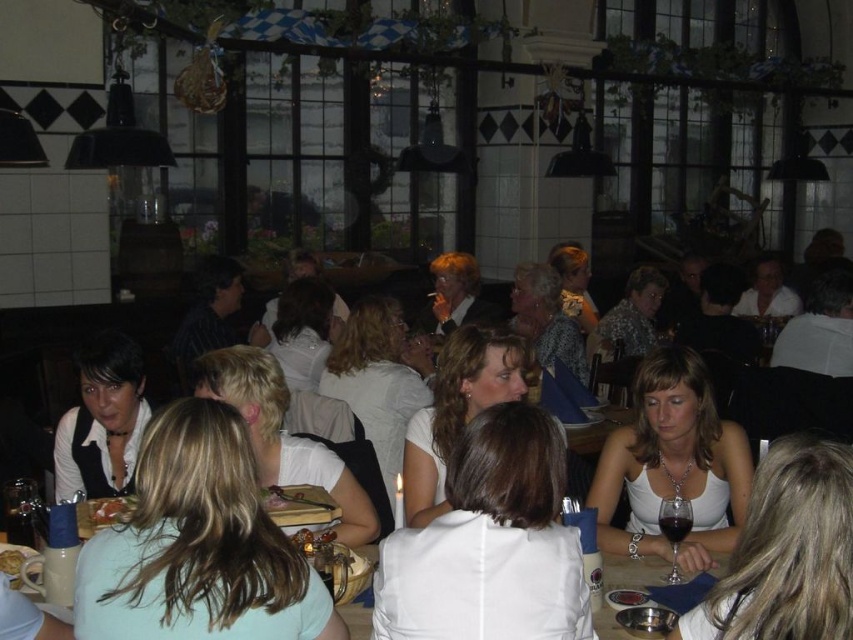
Question: Can you confirm if white matte shirt at lower left is positioned above white matte plate at center?

Choices:
 (A) yes
 (B) no

Answer: (A)

Question: Does white matte tank top at center have a smaller size compared to white fabric table at center?

Choices:
 (A) no
 (B) yes

Answer: (A)

Question: Which point is farther to the camera?

Choices:
 (A) white fabric table at center
 (B) white fabric dress at center
 (C) matte black vest at left

Answer: (C)

Question: Which point is farther to the camera?

Choices:
 (A) white fabric dress at center
 (B) white matte plate at center
 (C) white matte shirt at lower left
 (D) white fabric table at center

Answer: (B)

Question: Which object is positioned closest to the matte black vest at left?

Choices:
 (A) white fabric shirt at center
 (B) white matte plate at center
 (C) golden brown bread at lower left
 (D) white fabric table at center

Answer: (B)

Question: In this image, where is white fabric shirt at center located relative to matte black vest at left?

Choices:
 (A) left
 (B) right

Answer: (B)